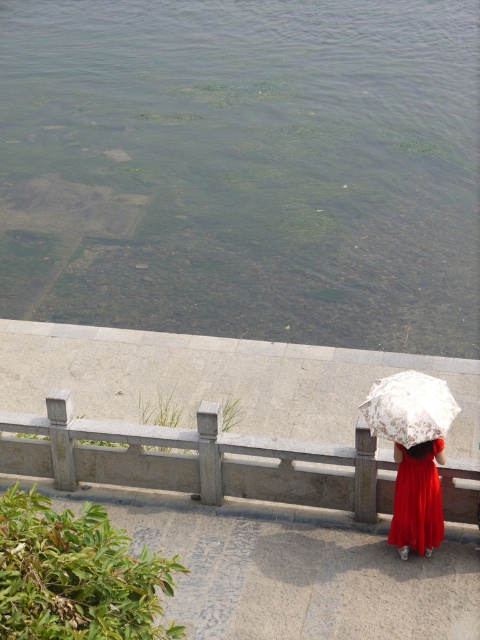
You are a photographer trying to capture the entire scene in one shot. Given that the green algae at upper center and the matte red dress at lower right are both in your frame, which object would appear bigger in your photo?

The green algae at upper center would appear bigger in the photo because it has a larger size compared to the matte red dress at lower right.

You are a photographer trying to capture the white lace umbrella at lower right and the gray stone railing at lower center in the same frame. Which object will appear larger in the photo?

The gray stone railing at lower center will appear larger in the photo because it is bigger than the white lace umbrella at lower right.